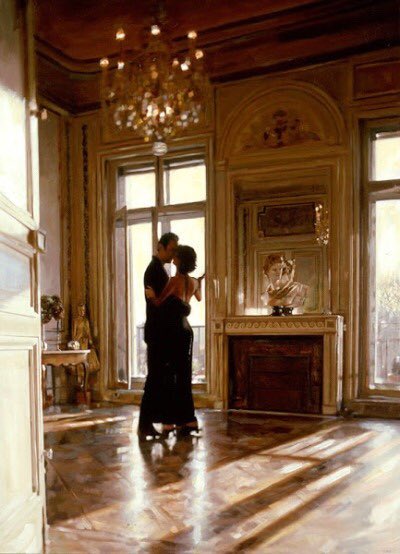
The image size is (400, 554). I want to click on ceiling, so click(72, 22).